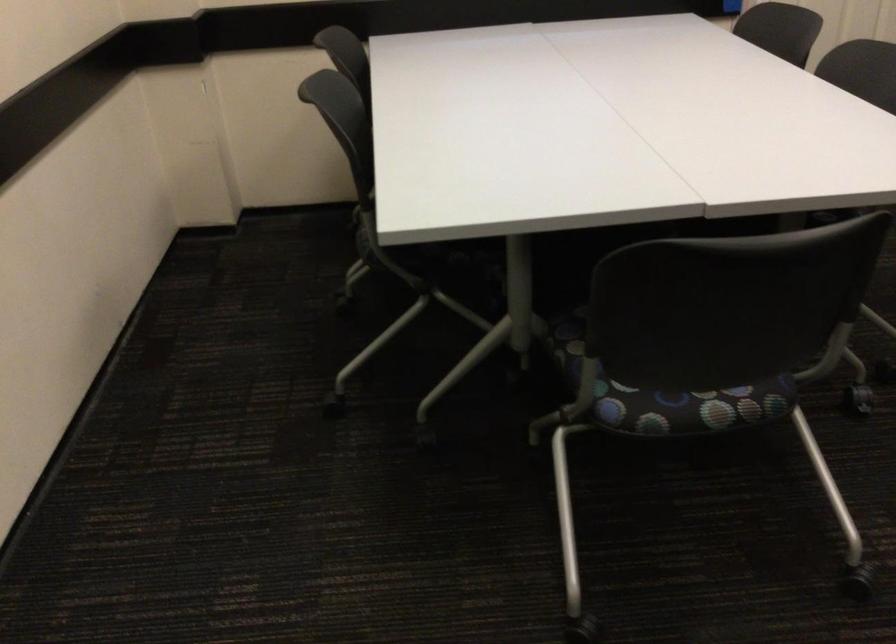
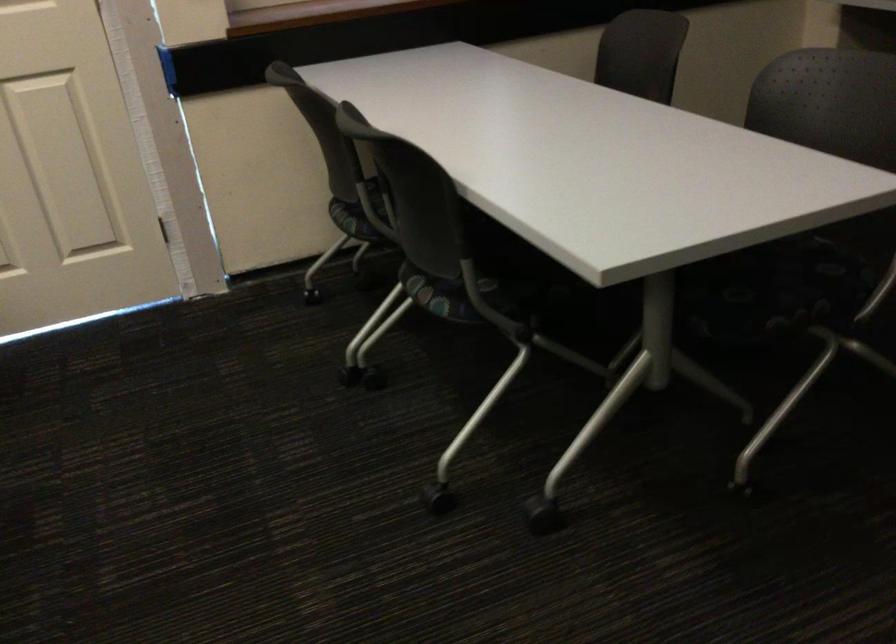
Question: In a continuous first-person perspective shot, in which direction is the camera moving?

Choices:
 (A) Left
 (B) Right
 (C) Forward
 (D) Backward

Answer: (B)